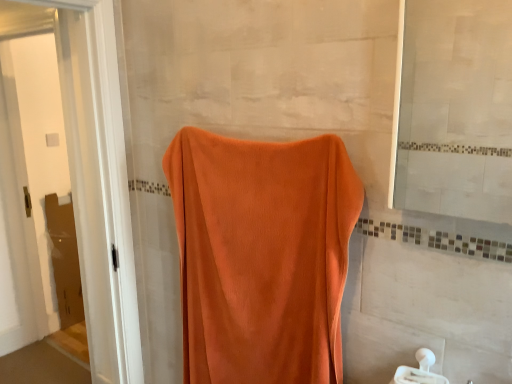
Question: Is white plastic towel bar at lower right next to orange towel at left?

Choices:
 (A) yes
 (B) no

Answer: (B)

Question: Does white plastic towel bar at lower right have a larger size compared to orange towel at left?

Choices:
 (A) yes
 (B) no

Answer: (B)

Question: Can you confirm if white plastic towel bar at lower right is wider than orange towel at left?

Choices:
 (A) yes
 (B) no

Answer: (B)

Question: Is orange towel at left at the back of white plastic towel bar at lower right?

Choices:
 (A) no
 (B) yes

Answer: (A)

Question: From a real-world perspective, is white plastic towel bar at lower right on top of orange towel at left?

Choices:
 (A) no
 (B) yes

Answer: (A)

Question: Is white plastic towel bar at lower right taller or shorter than orange velvety towel at center?

Choices:
 (A) short
 (B) tall

Answer: (A)

Question: In the image, is white plastic towel bar at lower right positioned in front of or behind orange velvety towel at center?

Choices:
 (A) front
 (B) behind

Answer: (B)

Question: From the image's perspective, relative to orange velvety towel at center, is white plastic towel bar at lower right above or below?

Choices:
 (A) below
 (B) above

Answer: (A)

Question: Choose the correct answer: Is white plastic towel bar at lower right inside orange velvety towel at center or outside it?

Choices:
 (A) outside
 (B) inside

Answer: (A)

Question: In the image, is matte glass mirror at upper right on the left side or the right side of orange velvety towel at center?

Choices:
 (A) right
 (B) left

Answer: (A)

Question: Is point (465, 19) positioned closer to the camera than point (292, 244)?

Choices:
 (A) farther
 (B) closer

Answer: (B)

Question: Is matte glass mirror at upper right in front of or behind orange velvety towel at center in the image?

Choices:
 (A) behind
 (B) front

Answer: (B)

Question: From a real-world perspective, is matte glass mirror at upper right positioned above or below orange velvety towel at center?

Choices:
 (A) below
 (B) above

Answer: (B)

Question: From the image's perspective, is orange velvety towel at center above or below orange towel at left?

Choices:
 (A) above
 (B) below

Answer: (B)

Question: Is orange velvety towel at center to the left or to the right of orange towel at left in the image?

Choices:
 (A) left
 (B) right

Answer: (B)